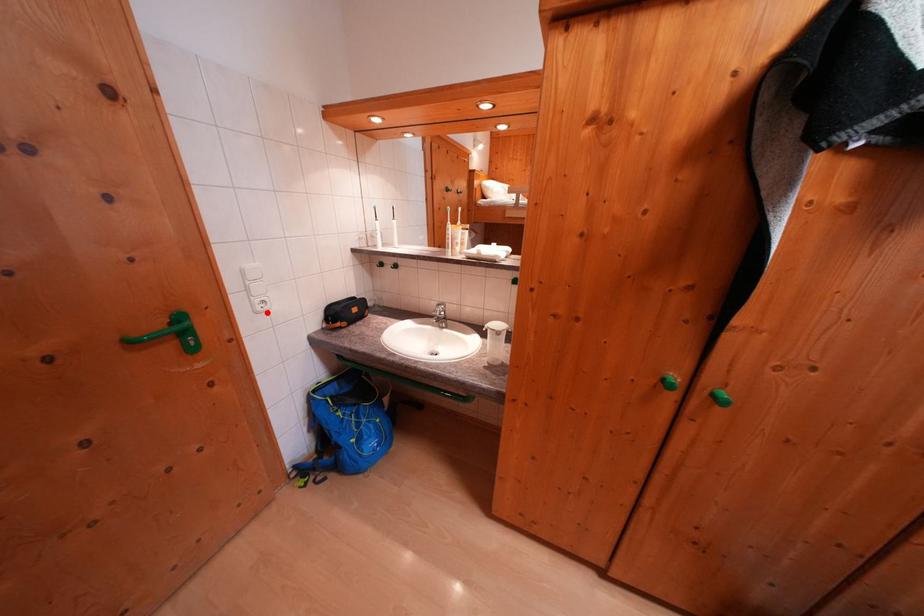
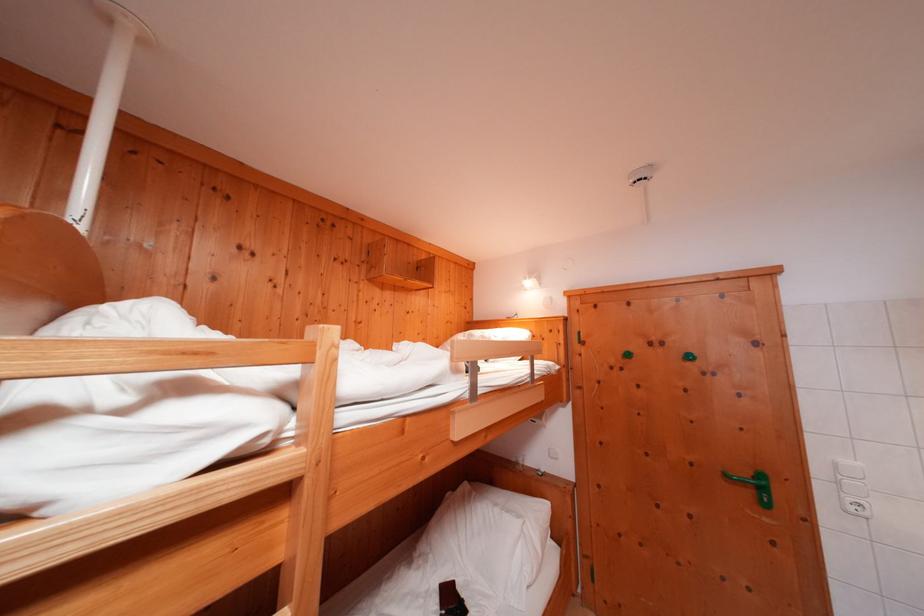
Question: A red point is marked in image1. In image2, is the corresponding 3D point closer to the camera or farther? Reply with the corresponding letter.

Choices:
 (A) The corresponding 3D point is closer.
 (B) The corresponding 3D point is farther.

Answer: (A)